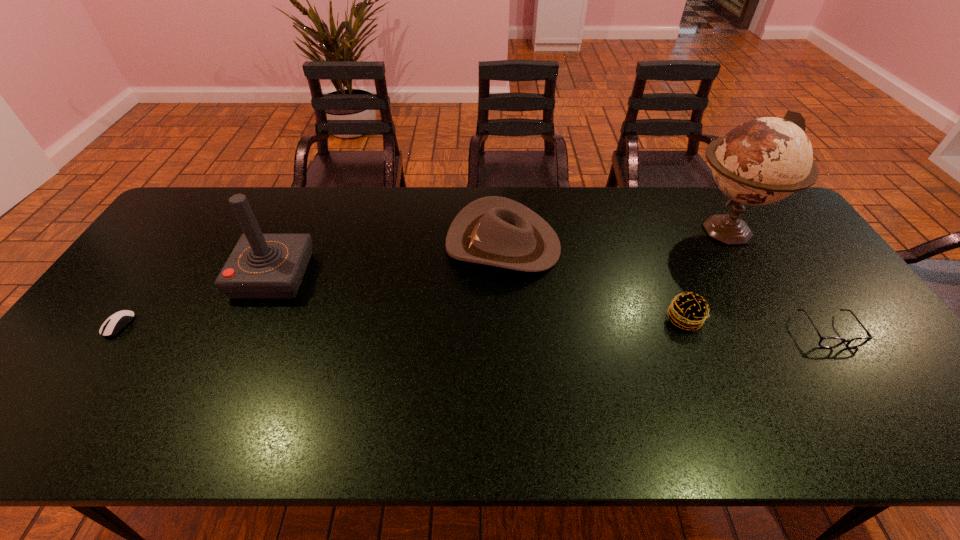
The width and height of the screenshot is (960, 540). I want to click on globe situated at the far edge, so click(x=762, y=161).

Image resolution: width=960 pixels, height=540 pixels. I want to click on cowboy hat located in the far edge section of the desktop, so click(x=497, y=231).

What are the coordinates of `object positioned at the left edge` in the screenshot? It's located at (117, 321).

This screenshot has height=540, width=960. Find the location of `globe that is at the right edge`. globe that is at the right edge is located at coordinates (762, 161).

Find the location of `spectacles present at the right edge`. spectacles present at the right edge is located at coordinates (826, 342).

Locate an element on the screen. This screenshot has height=540, width=960. object that is positioned at the far right corner is located at coordinates 762,161.

Find the location of `free space at the far edge`. free space at the far edge is located at coordinates (633, 226).

I want to click on free space at the left edge of the desktop, so click(178, 244).

This screenshot has height=540, width=960. In order to click on vacant region at the right edge in this screenshot , I will do `click(831, 330)`.

At what (x,y) coordinates should I click in order to perform the action: click on vacant space at the far left corner of the desktop. Please return your answer as a coordinate pair (x, y). Image resolution: width=960 pixels, height=540 pixels. Looking at the image, I should click on (208, 208).